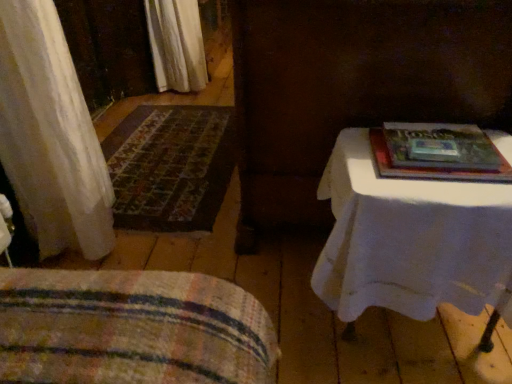
Question: Can you confirm if white cloth-covered table at right is shorter than striped fabric blanket at lower left?

Choices:
 (A) no
 (B) yes

Answer: (A)

Question: Can we say white cloth-covered table at right lies outside striped fabric blanket at lower left?

Choices:
 (A) yes
 (B) no

Answer: (A)

Question: Can you confirm if white cloth-covered table at right is wider than striped fabric blanket at lower left?

Choices:
 (A) no
 (B) yes

Answer: (A)

Question: Is white cloth-covered table at right to the left of striped fabric blanket at lower left from the viewer's perspective?

Choices:
 (A) yes
 (B) no

Answer: (B)

Question: From a real-world perspective, is white cloth-covered table at right located higher than striped fabric blanket at lower left?

Choices:
 (A) yes
 (B) no

Answer: (A)

Question: Does white cloth-covered table at right have a lesser width compared to striped fabric blanket at lower left?

Choices:
 (A) yes
 (B) no

Answer: (A)

Question: Is white cloth-covered table at right aimed at carpeted mat at left?

Choices:
 (A) yes
 (B) no

Answer: (B)

Question: Is white cloth-covered table at right bigger than carpeted mat at left?

Choices:
 (A) yes
 (B) no

Answer: (A)

Question: Can you confirm if white cloth-covered table at right is shorter than carpeted mat at left?

Choices:
 (A) no
 (B) yes

Answer: (A)

Question: Can you confirm if white cloth-covered table at right is thinner than carpeted mat at left?

Choices:
 (A) no
 (B) yes

Answer: (B)

Question: Is white cloth-covered table at right smaller than carpeted mat at left?

Choices:
 (A) no
 (B) yes

Answer: (A)

Question: Is white cloth-covered table at right outside of carpeted mat at left?

Choices:
 (A) yes
 (B) no

Answer: (A)

Question: Does hardcover book at upper right have a lesser width compared to white cloth-covered table at right?

Choices:
 (A) no
 (B) yes

Answer: (B)